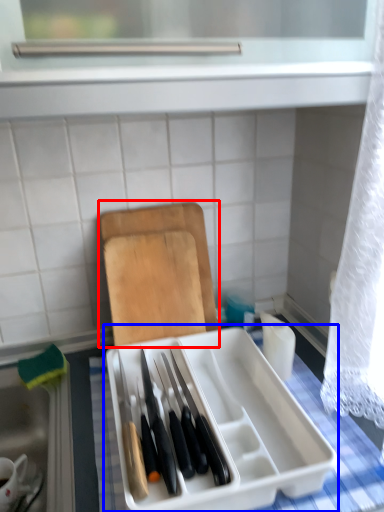
Question: Which of the following is the farthest to the observer, cutting board (highlighted by a red box) or appliance (highlighted by a blue box)?

Choices:
 (A) cutting board
 (B) appliance

Answer: (A)